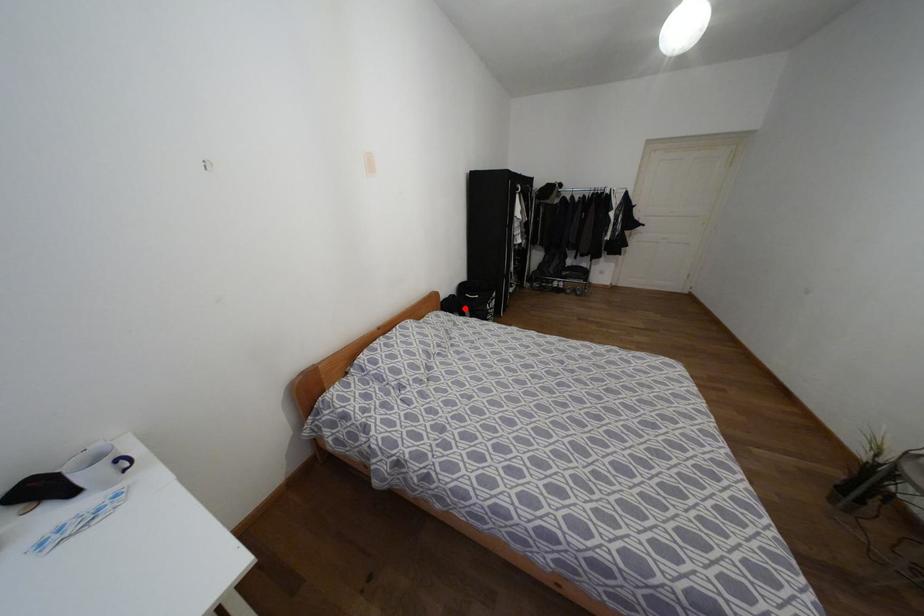
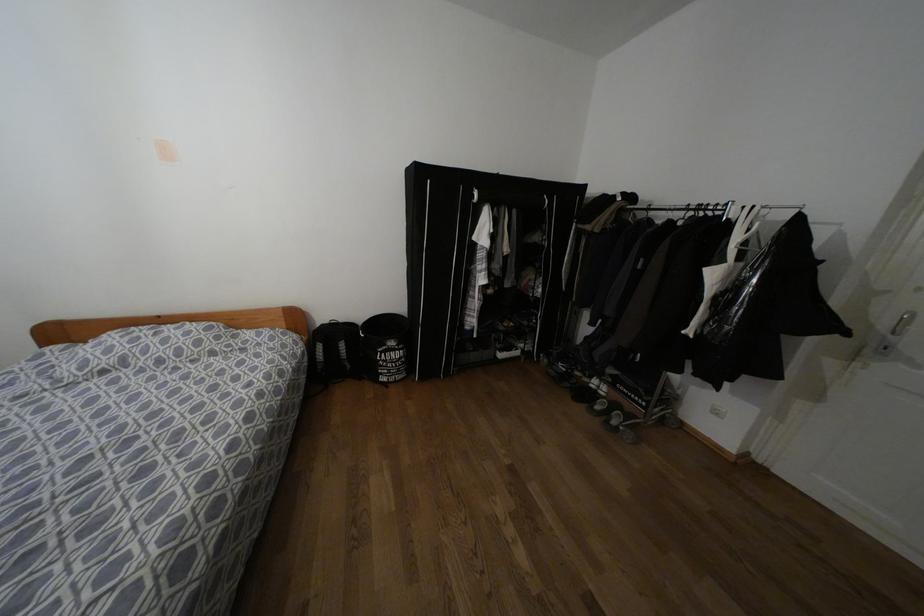
In the second image, find the point that corresponds to the highlighted location in the first image.

(342, 345)